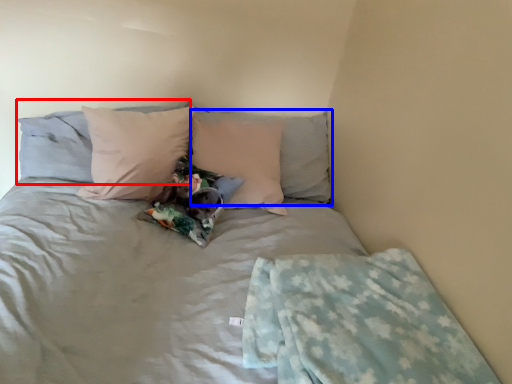
Question: Which object appears farthest to the camera in this image, pillow (highlighted by a red box) or pillow (highlighted by a blue box)?

Choices:
 (A) pillow
 (B) pillow

Answer: (B)